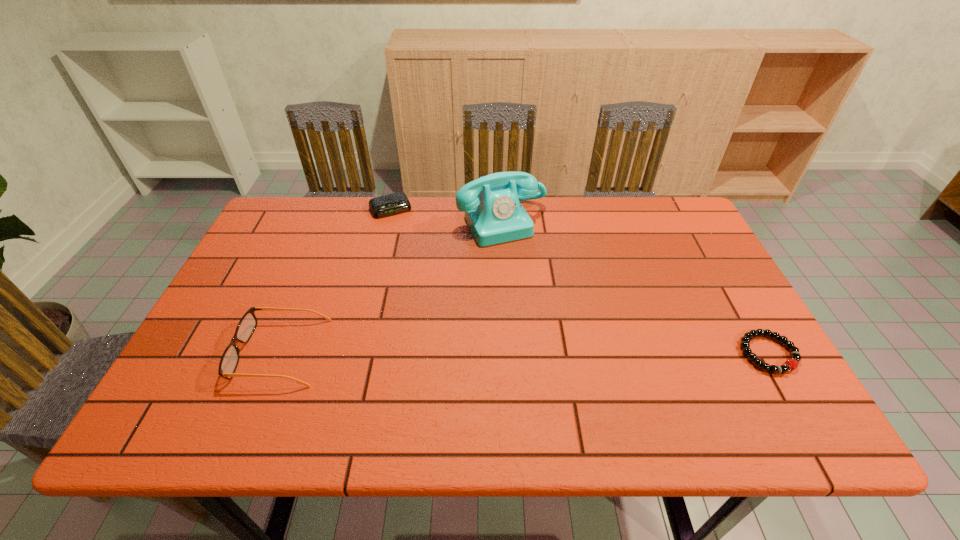
Locate an element on the screen. Image resolution: width=960 pixels, height=540 pixels. vacant spot on the desktop that is between the second tallest object and the bracelet and is positioned on the dial of the telephone is located at coordinates (579, 353).

The width and height of the screenshot is (960, 540). What are the coordinates of `vacant space on the desktop that is between the leftmost object and the rightmost object and is positioned on the display of the alarm clock` in the screenshot? It's located at (462, 353).